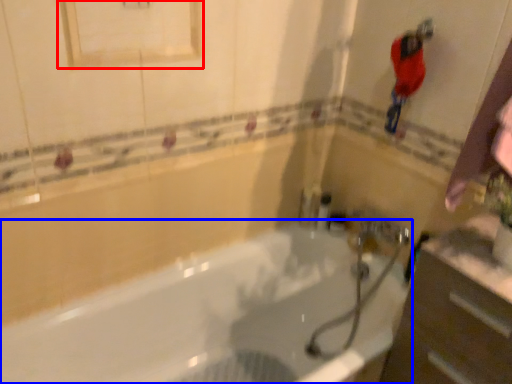
Question: Which object is closer to the camera taking this photo, medicine cabinet (highlighted by a red box) or bathtub (highlighted by a blue box)?

Choices:
 (A) medicine cabinet
 (B) bathtub

Answer: (B)